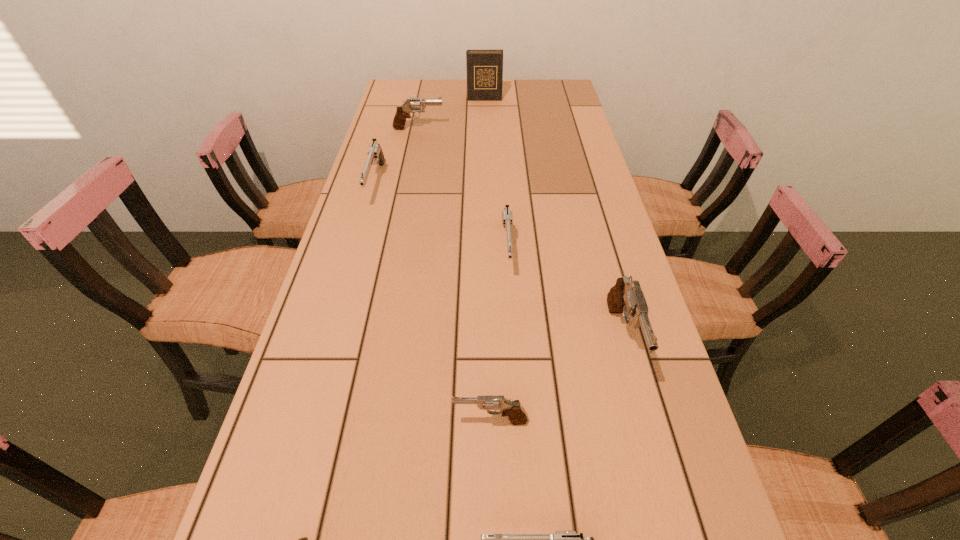
Locate which silver pistol is the second closest to the diary. Please provide its 2D coordinates. Your answer should be formatted as a tuple, i.e. [(x, y)], where the tuple contains the x and y coordinates of a point satisfying the conditions above.

[(507, 218)]

Select which silver pistol appears as the third closest to the third silver pistol from right to left. Please provide its 2D coordinates. Your answer should be formatted as a tuple, i.e. [(x, y)], where the tuple contains the x and y coordinates of a point satisfying the conditions above.

[(375, 155)]

You are a GUI agent. You are given a task and a screenshot of the screen. Output one action in this format:
    pyautogui.click(x=<x>, y=<y>)
    Task: Click on the vacant space that satisfies the following two spatial constraints: 1. on the front-facing side of the fifth nearest pistol; 2. at the barrel of the nearest gray pistol
    
    Given the screenshot: What is the action you would take?
    (517, 421)